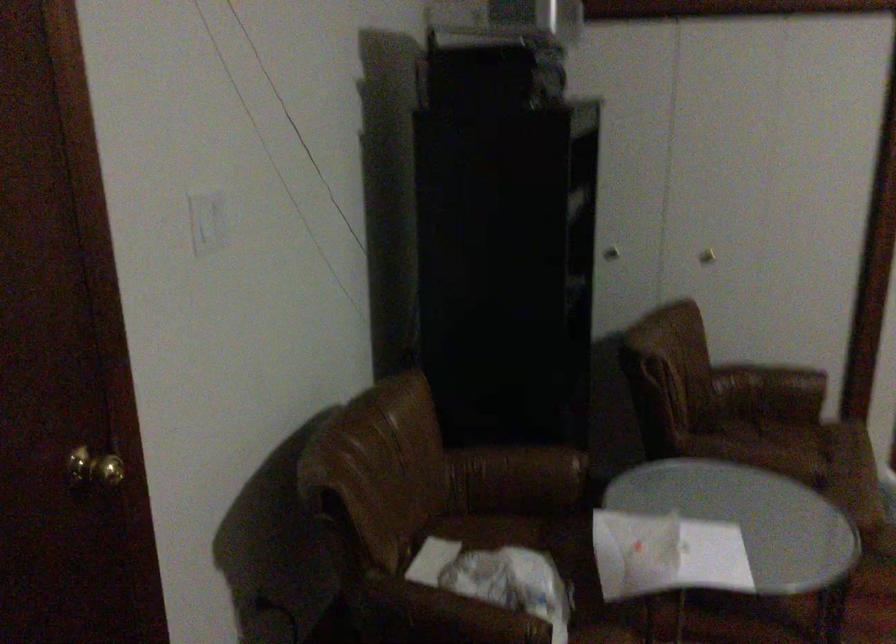
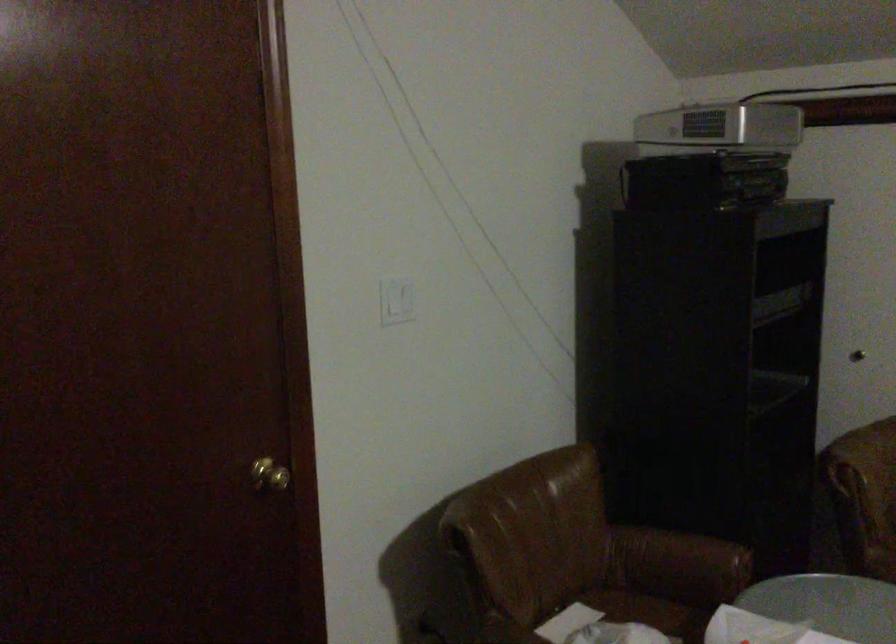
The point at [209,223] is marked in the first image. Where is the corresponding point in the second image?

(397, 301)